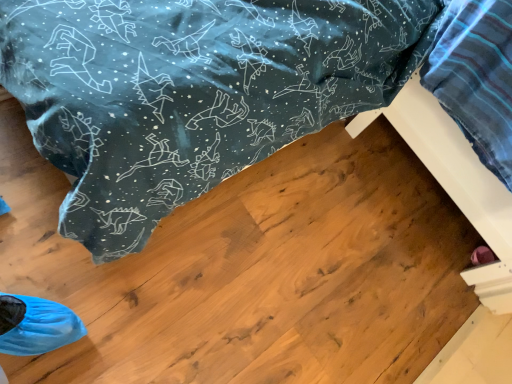
Question: Considering the relative positions of white wood bed frame at lower right, the second furniture viewed from the left, and wooden bed frame at lower right, which is the second furniture from right to left, in the image provided, is white wood bed frame at lower right, the second furniture viewed from the left, to the left of wooden bed frame at lower right, which is the second furniture from right to left, from the viewer's perspective?

Choices:
 (A) no
 (B) yes

Answer: (A)

Question: Is white wood bed frame at lower right, the second furniture viewed from the left, positioned far away from wooden bed frame at lower right, which is the second furniture from right to left?

Choices:
 (A) yes
 (B) no

Answer: (B)

Question: Can you confirm if white wood bed frame at lower right, the second furniture viewed from the left, is bigger than wooden bed frame at lower right, placed as the first furniture when sorted from left to right?

Choices:
 (A) yes
 (B) no

Answer: (A)

Question: From the image's perspective, would you say white wood bed frame at lower right, the 1th furniture in the right-to-left sequence, is positioned over wooden bed frame at lower right, placed as the first furniture when sorted from left to right?

Choices:
 (A) yes
 (B) no

Answer: (A)

Question: Is white wood bed frame at lower right, the second furniture viewed from the left, not within wooden bed frame at lower right, placed as the first furniture when sorted from left to right?

Choices:
 (A) yes
 (B) no

Answer: (A)

Question: Is wooden bed frame at lower right, placed as the first furniture when sorted from left to right, completely or partially inside white wood bed frame at lower right, the second furniture viewed from the left?

Choices:
 (A) no
 (B) yes

Answer: (A)

Question: Is wooden bed frame at lower right, placed as the first furniture when sorted from left to right, positioned far away from white wood bed frame at lower right, the 1th furniture in the right-to-left sequence?

Choices:
 (A) no
 (B) yes

Answer: (A)

Question: Is white wood bed frame at lower right, the second furniture viewed from the left, inside wooden bed frame at lower right, which is the second furniture from right to left?

Choices:
 (A) no
 (B) yes

Answer: (A)

Question: Can you confirm if wooden bed frame at lower right, which is the second furniture from right to left, is taller than white wood bed frame at lower right, the second furniture viewed from the left?

Choices:
 (A) yes
 (B) no

Answer: (B)

Question: Is white wood bed frame at lower right, the 1th furniture in the right-to-left sequence, at the back of wooden bed frame at lower right, which is the second furniture from right to left?

Choices:
 (A) yes
 (B) no

Answer: (B)

Question: From a real-world perspective, is wooden bed frame at lower right, which is the second furniture from right to left, located beneath white wood bed frame at lower right, the second furniture viewed from the left?

Choices:
 (A) yes
 (B) no

Answer: (A)

Question: Is wooden bed frame at lower right, which is the second furniture from right to left, wider than white wood bed frame at lower right, the second furniture viewed from the left?

Choices:
 (A) yes
 (B) no

Answer: (A)

Question: In terms of width, does wooden bed frame at lower right, placed as the first furniture when sorted from left to right, look wider or thinner when compared to white wood bed frame at lower right, the second furniture viewed from the left?

Choices:
 (A) thin
 (B) wide

Answer: (B)